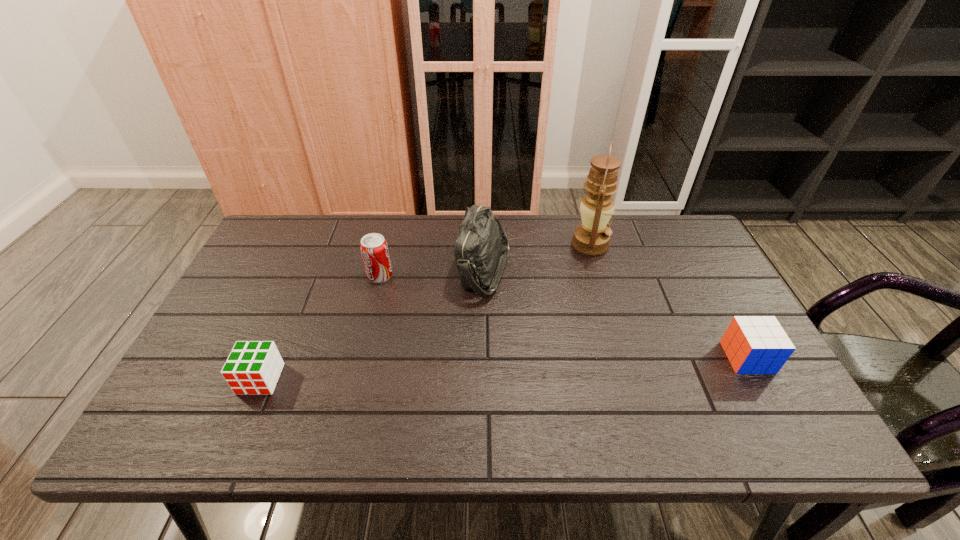
Where is `vacant space at the near edge`? vacant space at the near edge is located at coordinates pyautogui.click(x=346, y=426).

Locate an element on the screen. This screenshot has height=540, width=960. free region at the left edge of the desktop is located at coordinates (192, 374).

You are a GUI agent. You are given a task and a screenshot of the screen. Output one action in this format:
    pyautogui.click(x=<x>, y=<y>)
    Task: Click on the free space at the far left corner
    
    Given the screenshot: What is the action you would take?
    pyautogui.click(x=307, y=238)

In the image, there is a desktop. Where is `free space at the near left corner`? free space at the near left corner is located at coordinates (166, 441).

I want to click on vacant space at the far right corner, so click(696, 249).

You are a GUI agent. You are given a task and a screenshot of the screen. Output one action in this format:
    pyautogui.click(x=<x>, y=<y>)
    Task: Click on the vacant area that lies between the shoulder bag and the left cube
    The image size is (960, 540).
    Given the screenshot: What is the action you would take?
    pyautogui.click(x=372, y=325)

Find the location of a particular element. free space between the rightmost object and the leftmost object is located at coordinates (504, 368).

The width and height of the screenshot is (960, 540). In order to click on vacant area between the oil lamp and the left cube in this screenshot , I will do `click(425, 312)`.

Identify the location of free spot between the shoulder bag and the leftmost object. (372, 325).

The width and height of the screenshot is (960, 540). Identify the location of vacant space that's between the rightmost object and the shoulder bag. (615, 314).